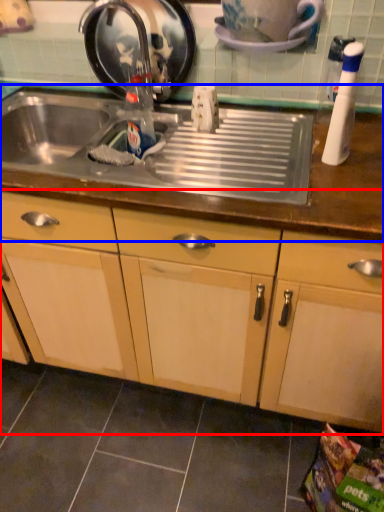
Question: Which point is further to the camera, cabinetry (highlighted by a red box) or countertop (highlighted by a blue box)?

Choices:
 (A) cabinetry
 (B) countertop

Answer: (B)